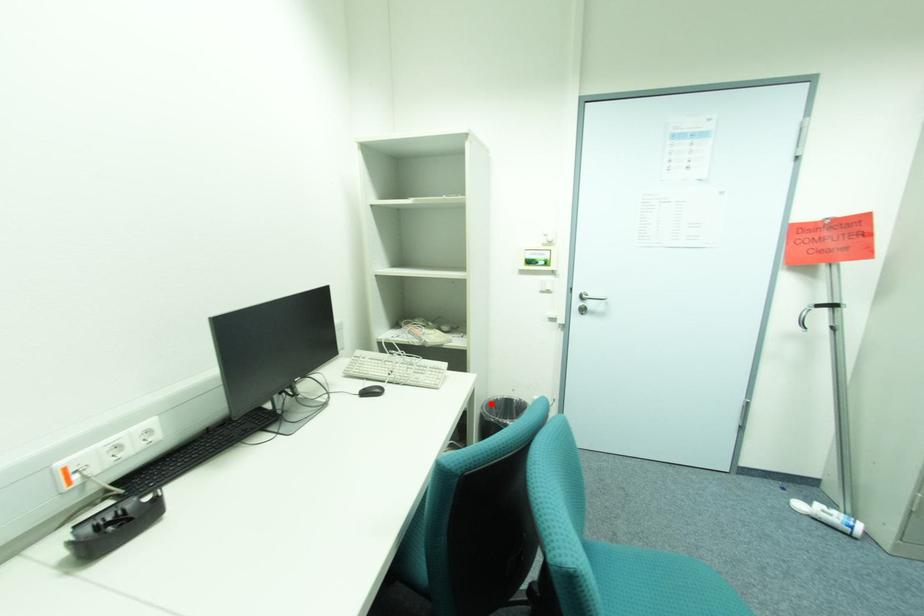
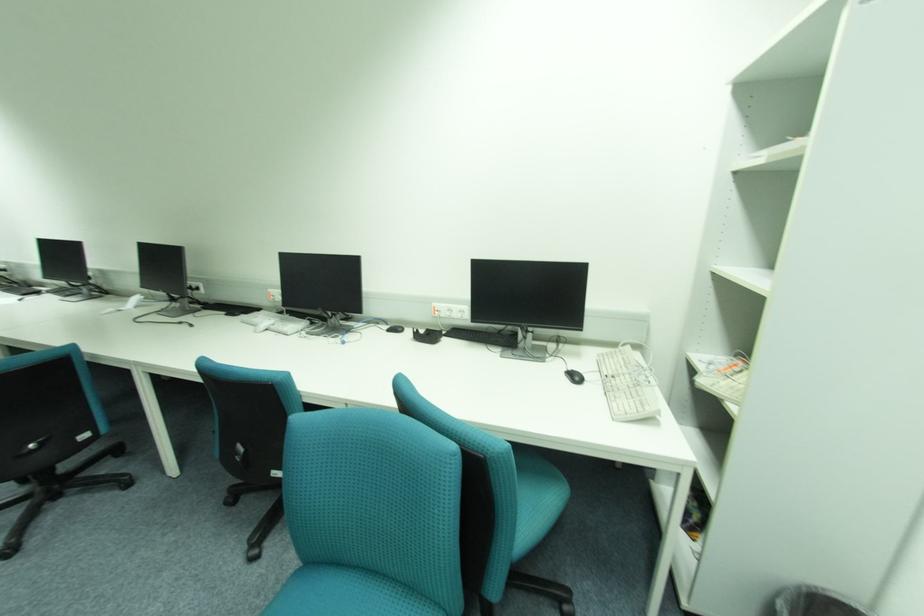
Where in the second image is the point corresponding to the highlighted location from the first image?

(837, 594)